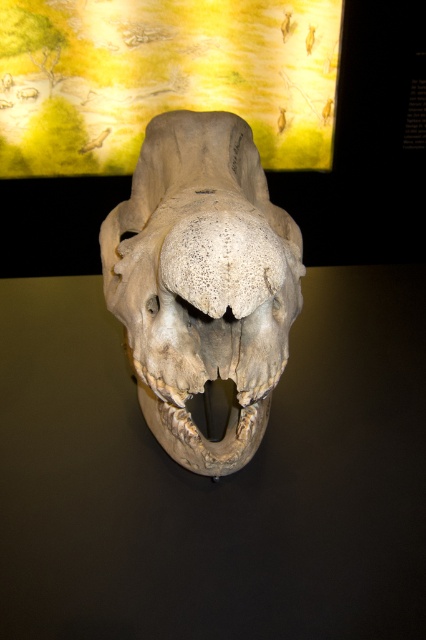
Question: Is transparent glass skull at center wider than gray textured skull at center?

Choices:
 (A) yes
 (B) no

Answer: (A)

Question: Which point is farther from the camera taking this photo?

Choices:
 (A) (175, 163)
 (B) (333, 564)

Answer: (A)

Question: Does transparent glass skull at center appear on the left side of gray textured skull at center?

Choices:
 (A) no
 (B) yes

Answer: (B)

Question: Which of the following is the closest to the observer?

Choices:
 (A) pos(170,296)
 (B) pos(313,490)

Answer: (A)

Question: Does transparent glass skull at center appear on the right side of gray textured skull at center?

Choices:
 (A) no
 (B) yes

Answer: (A)